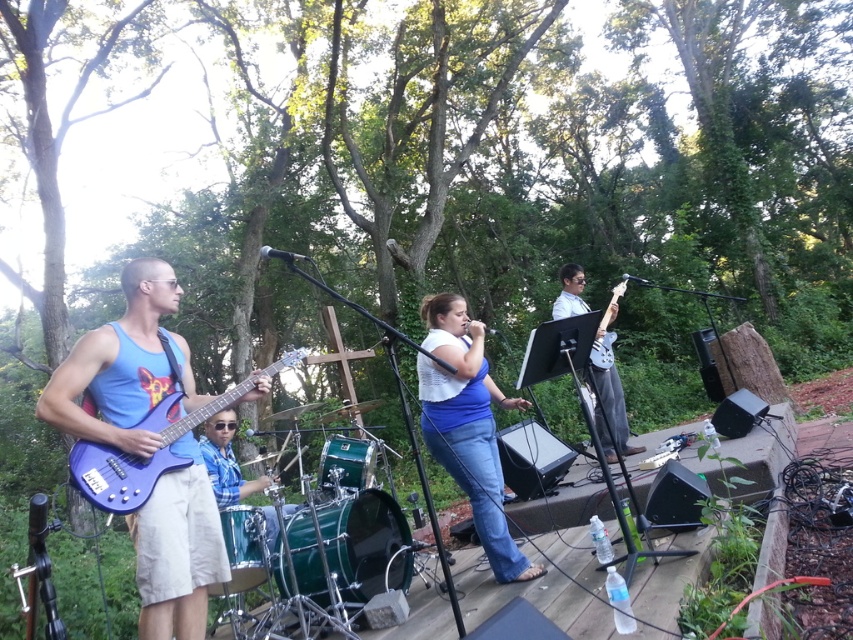
Consider the image. Can you confirm if matte blue guitar at left is positioned below matte black guitar at center?

Yes, matte blue guitar at left is below matte black guitar at center.

I want to click on matte blue guitar at left, so click(125, 365).

Between point (73, 380) and point (616, 307), which one is positioned in front?

Point (73, 380)

You are a GUI agent. You are given a task and a screenshot of the screen. Output one action in this format:
    pyautogui.click(x=<x>, y=<y>)
    Task: Click on the matte blue guitar at left
    
    Given the screenshot: What is the action you would take?
    pyautogui.click(x=125, y=365)

Can you confirm if matte blue electric guitar at left is wider than matte black guitar at center?

Indeed, matte blue electric guitar at left has a greater width compared to matte black guitar at center.

Between point (131, 493) and point (598, 410), which one is positioned behind?

The point (598, 410) is behind.

Which is in front, point (123, 461) or point (572, 285)?

Point (123, 461)

Find the location of a particular element. The height and width of the screenshot is (640, 853). matte blue electric guitar at left is located at coordinates (140, 456).

Is matte blue guitar at left to the left of blue denim jeans at center from the viewer's perspective?

Indeed, matte blue guitar at left is positioned on the left side of blue denim jeans at center.

Is point (140, 298) positioned before point (519, 404)?

Yes, point (140, 298) is in front of point (519, 404).

Who is more forward, (152,387) or (488,436)?

Point (152,387) is in front.

The width and height of the screenshot is (853, 640). I want to click on matte blue guitar at left, so click(x=125, y=365).